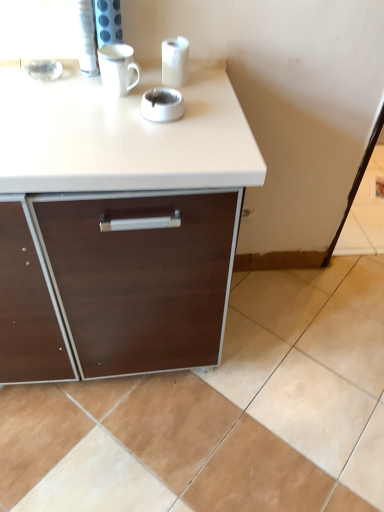
Describe the element at coordinates (162, 105) in the screenshot. I see `white glossy ashtray at center` at that location.

Locate an element on the screen. white glossy mug at upper center is located at coordinates click(x=118, y=68).

Describe the element at coordinates (175, 61) in the screenshot. I see `white glossy paper towel at upper center` at that location.

The width and height of the screenshot is (384, 512). What do you see at coordinates (222, 412) in the screenshot?
I see `beige ceramic tile at lower right` at bounding box center [222, 412].

Where is `white glossy ashtray at center`? The width and height of the screenshot is (384, 512). white glossy ashtray at center is located at coordinates (162, 105).

Which is more to the right, white glossy paper towel at upper center or white glossy mug at upper center?

white glossy paper towel at upper center.

Is point (163, 44) closer to camera compared to point (122, 68)?

No, (163, 44) is behind (122, 68).

Based on the photo, from the image's perspective, is white glossy paper towel at upper center beneath white glossy mug at upper center?

No.

Is white glossy paper towel at upper center not within white glossy mug at upper center?

Absolutely, white glossy paper towel at upper center is external to white glossy mug at upper center.

Is beige ceramic tile at lower right next to white glossy paper towel at upper center?

There is a gap between beige ceramic tile at lower right and white glossy paper towel at upper center.

Can you confirm if beige ceramic tile at lower right is taller than white glossy paper towel at upper center?

Incorrect, the height of beige ceramic tile at lower right is not larger of that of white glossy paper towel at upper center.

The image size is (384, 512). What are the coordinates of `paper towel above the beige ceramic tile at lower right (from a real-world perspective)` in the screenshot? It's located at (175, 61).

From the picture: From a real-world perspective, is beige ceramic tile at lower right beneath white glossy paper towel at upper center?

Indeed, from a real-world perspective, beige ceramic tile at lower right is positioned beneath white glossy paper towel at upper center.

Is white glossy mug at upper center facing away from white glossy ashtray at center?

No.

Considering the positions of objects white glossy mug at upper center and white glossy ashtray at center in the image provided, who is in front, white glossy mug at upper center or white glossy ashtray at center?

white glossy ashtray at center is in front.

Looking at this image, from the image's perspective, is white glossy mug at upper center beneath white glossy ashtray at center?

Incorrect, from the image's perspective, white glossy mug at upper center is higher than white glossy ashtray at center.

Is white glossy mug at upper center completely or partially outside of white glossy ashtray at center?

Yes, white glossy mug at upper center is outside of white glossy ashtray at center.

Is white glossy ashtray at center at the right side of white glossy paper towel at upper center?

No, white glossy ashtray at center is not to the right of white glossy paper towel at upper center.

From the image's perspective, between white glossy ashtray at center and white glossy paper towel at upper center, who is located below?

white glossy ashtray at center.

From a real-world perspective, who is located lower, white glossy ashtray at center or white glossy paper towel at upper center?

white glossy ashtray at center, from a real-world perspective.

Is beige ceramic tile at lower right beside white glossy ashtray at center?

No, beige ceramic tile at lower right is not next to white glossy ashtray at center.

From the picture: From a real-world perspective, is beige ceramic tile at lower right beneath white glossy ashtray at center?

Yes, from a real-world perspective, beige ceramic tile at lower right is below white glossy ashtray at center.

In the scene shown: Which of these two, beige ceramic tile at lower right or white glossy ashtray at center, is thinner?

With smaller width is white glossy ashtray at center.

From the image's perspective, between beige ceramic tile at lower right and white glossy ashtray at center, who is located below?

beige ceramic tile at lower right appears lower in the image.

Considering the relative sizes of white glossy mug at upper center and beige ceramic tile at lower right in the image provided, is white glossy mug at upper center smaller than beige ceramic tile at lower right?

Yes.

Considering the points (120, 58) and (378, 497), which point is behind, point (120, 58) or point (378, 497)?

The point (378, 497) is more distant.

Could you tell me if white glossy mug at upper center is turned towards beige ceramic tile at lower right?

No, white glossy mug at upper center does not turn towards beige ceramic tile at lower right.

Is white glossy mug at upper center directly adjacent to beige ceramic tile at lower right?

white glossy mug at upper center and beige ceramic tile at lower right are not in contact.

From a real-world perspective, is beige ceramic tile at lower right above or below white glossy mug at upper center?

beige ceramic tile at lower right is situated lower than white glossy mug at upper center in the real world.

Looking at their sizes, would you say beige ceramic tile at lower right is wider or thinner than white glossy mug at upper center?

beige ceramic tile at lower right is wider than white glossy mug at upper center.

The width and height of the screenshot is (384, 512). Find the location of `mug lying above the beige ceramic tile at lower right (from the image's perspective)`. mug lying above the beige ceramic tile at lower right (from the image's perspective) is located at coordinates (118, 68).

Does beige ceramic tile at lower right appear on the right side of white glossy mug at upper center?

Yes.

This screenshot has width=384, height=512. Find the location of `paper towel on the right of white glossy mug at upper center`. paper towel on the right of white glossy mug at upper center is located at coordinates (175, 61).

I want to click on paper towel on the left of beige ceramic tile at lower right, so click(x=175, y=61).

When comparing their distances from beige ceramic tile at lower right, does white glossy ashtray at center or white glossy paper towel at upper center seem closer?

white glossy ashtray at center is positioned closer to the anchor beige ceramic tile at lower right.

Based on their spatial positions, is white glossy paper towel at upper center or white glossy ashtray at center further from white glossy mug at upper center?

white glossy paper towel at upper center is positioned further to the anchor white glossy mug at upper center.

In the scene shown: Based on their spatial positions, is white glossy ashtray at center or beige ceramic tile at lower right further from white glossy paper towel at upper center?

beige ceramic tile at lower right lies further to white glossy paper towel at upper center than the other object.

Looking at the image, which one is located further to white glossy ashtray at center, beige ceramic tile at lower right or white glossy paper towel at upper center?

beige ceramic tile at lower right is further to white glossy ashtray at center.

When comparing their distances from white glossy mug at upper center, does white glossy ashtray at center or beige ceramic tile at lower right seem further?

beige ceramic tile at lower right is positioned further to the anchor white glossy mug at upper center.

When comparing their distances from beige ceramic tile at lower right, does white glossy mug at upper center or white glossy ashtray at center seem further?

white glossy mug at upper center is positioned further to the anchor beige ceramic tile at lower right.

Looking at this image, looking at the image, which one is located closer to beige ceramic tile at lower right, white glossy ashtray at center or white glossy mug at upper center?

white glossy ashtray at center lies closer to beige ceramic tile at lower right than the other object.

Estimate the real-world distances between objects in this image. Which object is further from white glossy mug at upper center, beige ceramic tile at lower right or white glossy ashtray at center?

Based on the image, beige ceramic tile at lower right appears to be further to white glossy mug at upper center.

This screenshot has height=512, width=384. Identify the location of appliance that lies between white glossy mug at upper center and beige ceramic tile at lower right from top to bottom. (162, 105).

You are a GUI agent. You are given a task and a screenshot of the screen. Output one action in this format:
    pyautogui.click(x=<x>, y=<y>)
    Task: Click on the appliance situated between white glossy mug at upper center and white glossy paper towel at upper center from left to right
    The width and height of the screenshot is (384, 512).
    Given the screenshot: What is the action you would take?
    click(x=162, y=105)

What are the coordinates of `mug between white glossy paper towel at upper center and beige ceramic tile at lower right vertically` in the screenshot? It's located at (118, 68).

Where is `appliance between white glossy paper towel at upper center and beige ceramic tile at lower right from top to bottom`? appliance between white glossy paper towel at upper center and beige ceramic tile at lower right from top to bottom is located at coordinates (162, 105).